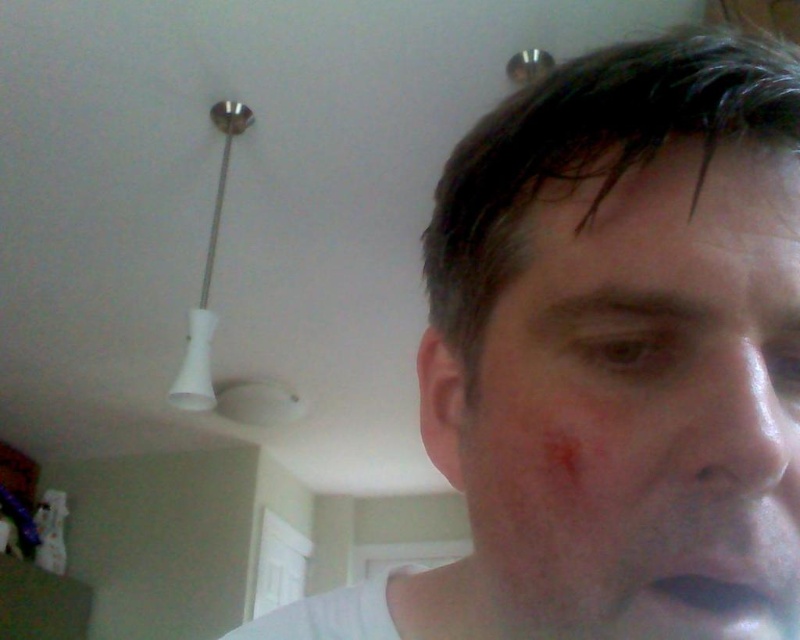
Who is higher up, matte white face at upper right or matte white lips at lower right?

matte white face at upper right

Can you confirm if matte white face at upper right is thinner than matte white lips at lower right?

No, matte white face at upper right is not thinner than matte white lips at lower right.

Is point (578, 145) farther from viewer compared to point (798, 609)?

Yes, it is.

Find the location of a particular element. This screenshot has width=800, height=640. matte white face at upper right is located at coordinates (604, 342).

Can you confirm if dry skin at upper center is smaller than smooth skin nose at center?

Indeed, dry skin at upper center has a smaller size compared to smooth skin nose at center.

Based on the photo, can you confirm if dry skin at upper center is wider than smooth skin nose at center?

Yes.

Is point (562, 189) less distant than point (756, 472)?

That is False.

Locate an element on the screen. dry skin at upper center is located at coordinates (672, 193).

Which is above, smooth skin scar at center or smooth skin nose at center?

smooth skin scar at center

Which is behind, point (720, 376) or point (705, 460)?

The point (720, 376) is more distant.

Does point (646, 470) lie in front of point (737, 371)?

No.

Locate an element on the screen. smooth skin scar at center is located at coordinates (644, 406).